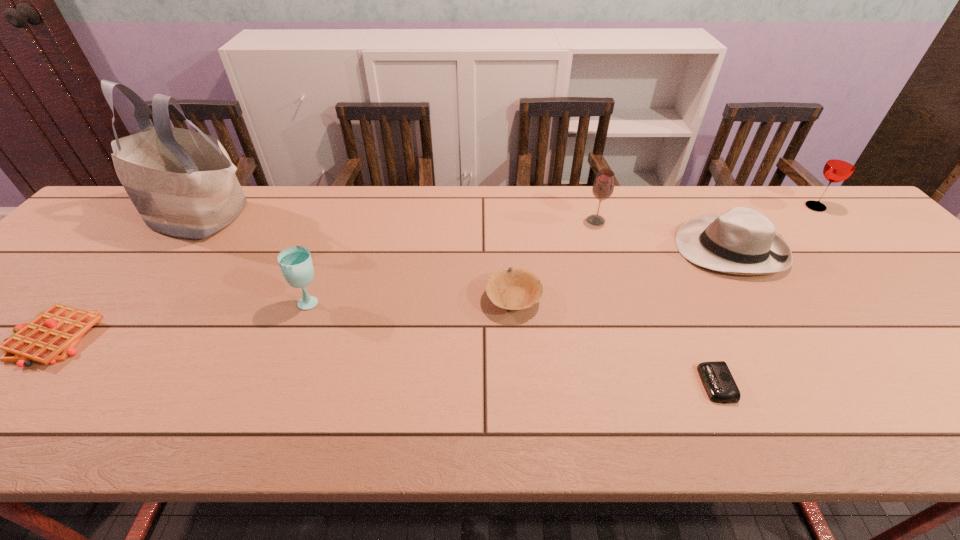
Identify which glass is located as the second nearest to the farthest glass. Please provide its 2D coordinates. Your answer should be formatted as a tuple, i.e. [(x, y)], where the tuple contains the x and y coordinates of a point satisfying the conditions above.

[(295, 262)]

The height and width of the screenshot is (540, 960). I want to click on glass that is the third nearest to the waffle, so (840, 166).